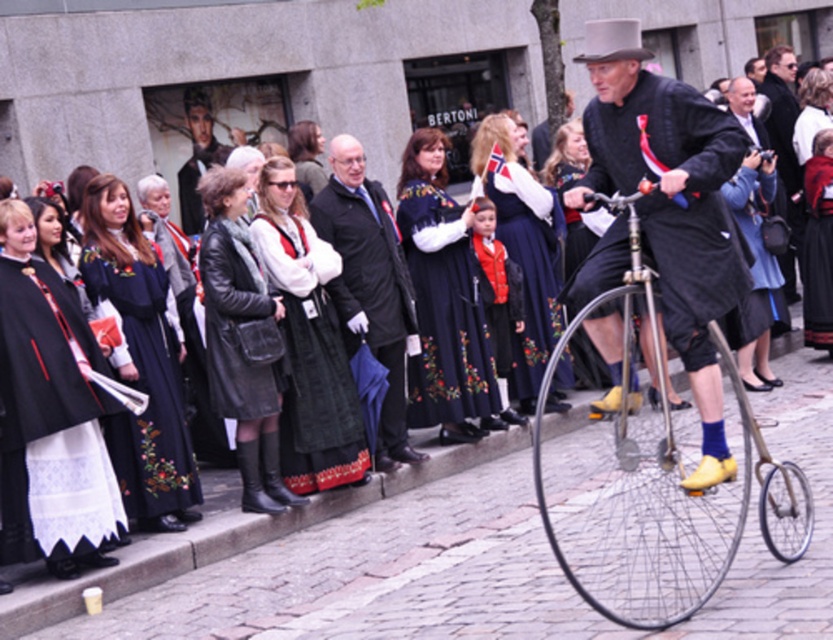
Question: Does black wool coat at center have a smaller size compared to metallic silver bicycle wheel at center?

Choices:
 (A) yes
 (B) no

Answer: (B)

Question: Which point is farther to the camera?

Choices:
 (A) matte black coat at center
 (B) shiny silver bicycle at right

Answer: (A)

Question: Does shiny silver bicycle at right have a lesser width compared to black wool coat at center?

Choices:
 (A) no
 (B) yes

Answer: (A)

Question: Does cobblestone pavement at lower center have a lesser width compared to shiny silver bicycle at right?

Choices:
 (A) yes
 (B) no

Answer: (A)

Question: Which point appears farthest from the camera in this image?

Choices:
 (A) (766, 515)
 (B) (410, 289)
 (C) (407, 556)
 (D) (626, 189)

Answer: (B)

Question: Which object appears farthest from the camera in this image?

Choices:
 (A) black wool coat at center
 (B) cobblestone pavement at lower center
 (C) metallic silver bicycle wheel at center
 (D) matte black coat at center

Answer: (A)